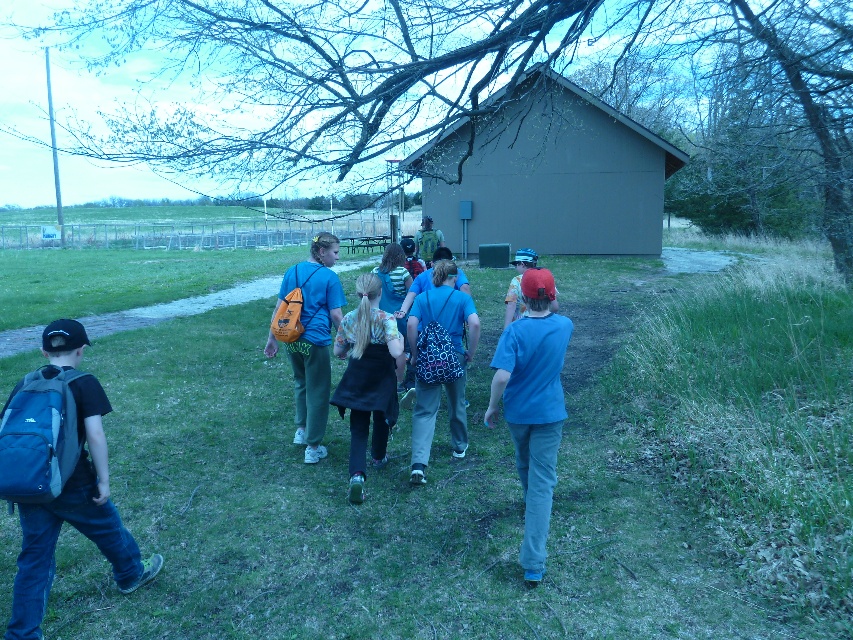
Who is taller, brown matte hut at center or floral fabric dress at center?

With more height is brown matte hut at center.

Who is higher up, brown matte hut at center or floral fabric dress at center?

brown matte hut at center

Is point (619, 182) in front of point (389, 364)?

No, it is behind (389, 364).

In order to click on brown matte hut at center in this screenshot , I will do `click(547, 173)`.

Can you confirm if blue fabric backpack at left is bigger than orange fabric backpack at center?

No.

What are the coordinates of `blue fabric backpack at left` in the screenshot? It's located at (61, 476).

Where is `blue fabric backpack at left`? Image resolution: width=853 pixels, height=640 pixels. blue fabric backpack at left is located at coordinates (61, 476).

Which of these two, green grass at lower center or blue fabric backpack at left, stands shorter?

blue fabric backpack at left is shorter.

Which is below, green grass at lower center or blue fabric backpack at left?

Positioned lower is blue fabric backpack at left.

The width and height of the screenshot is (853, 640). Find the location of `green grass at lower center`. green grass at lower center is located at coordinates (502, 474).